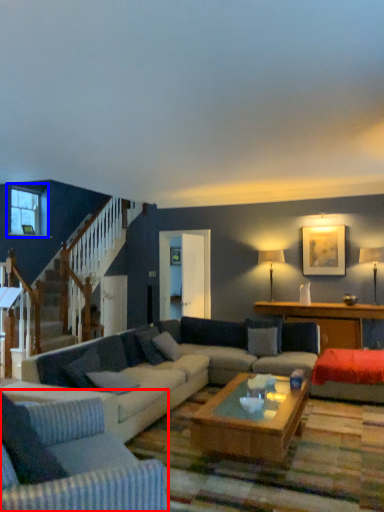
Question: Among these objects, which one is farthest to the camera, studio couch (highlighted by a red box) or window (highlighted by a blue box)?

Choices:
 (A) studio couch
 (B) window

Answer: (B)